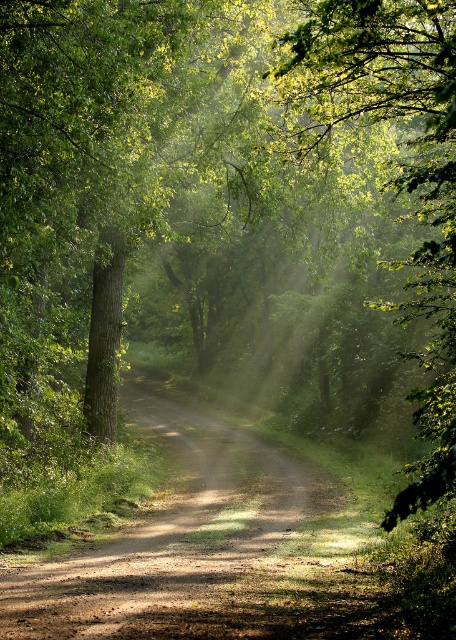
Is dirt road at center taller than green leafy tree at center?

In fact, dirt road at center may be shorter than green leafy tree at center.

Does dirt road at center have a greater width compared to green leafy tree at center?

No, dirt road at center is not wider than green leafy tree at center.

Locate an element on the screen. This screenshot has height=640, width=456. dirt road at center is located at coordinates (196, 550).

At what (x,y) coordinates should I click in order to perform the action: click on dirt road at center. Please return your answer as a coordinate pair (x, y). The image size is (456, 640). Looking at the image, I should click on (196, 550).